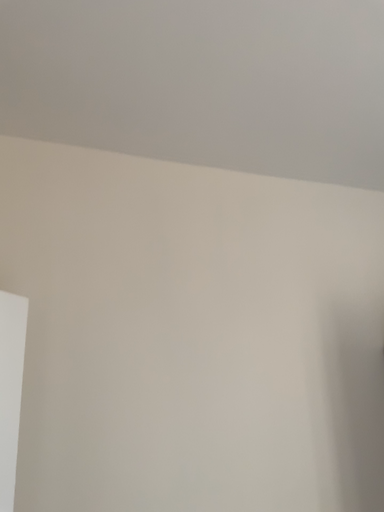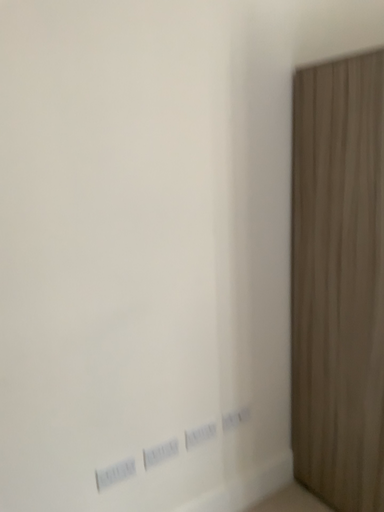
Question: Which way did the camera rotate in the video?

Choices:
 (A) rotated left
 (B) rotated right

Answer: (B)